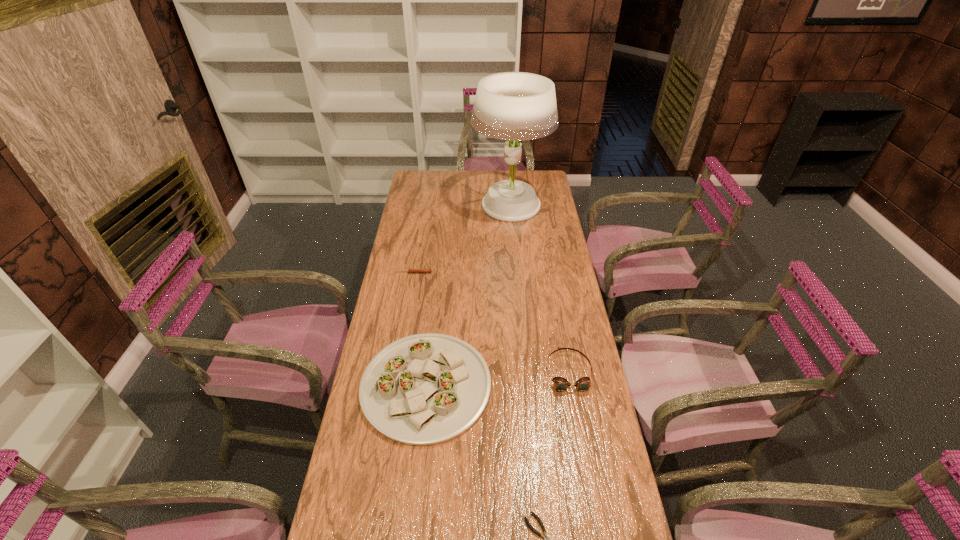
Find the location of a particular element. the tallest object is located at coordinates (515, 106).

What are the coordinates of `the farthest object` in the screenshot? It's located at (515, 106).

Image resolution: width=960 pixels, height=540 pixels. What are the coordinates of `the fourth shortest object` in the screenshot? It's located at (424, 389).

Where is `the third tallest object`? The width and height of the screenshot is (960, 540). the third tallest object is located at coordinates (560, 384).

Find the location of a particular element. Image resolution: width=960 pixels, height=540 pixels. sausage is located at coordinates (410, 270).

Find the location of a particular element. the second farthest object is located at coordinates (410, 270).

The height and width of the screenshot is (540, 960). Identify the location of free space located on the front-facing side of the lamp. (433, 205).

Identify the location of vacant space situated on the front-facing side of the lamp. This screenshot has width=960, height=540. point(444,205).

The image size is (960, 540). Find the location of `vacant space located 0.190m on the front-facing side of the lamp`. vacant space located 0.190m on the front-facing side of the lamp is located at coordinates (433, 205).

Locate an element on the screen. Image resolution: width=960 pixels, height=540 pixels. vacant space located 0.130m on the back of the platter is located at coordinates (434, 310).